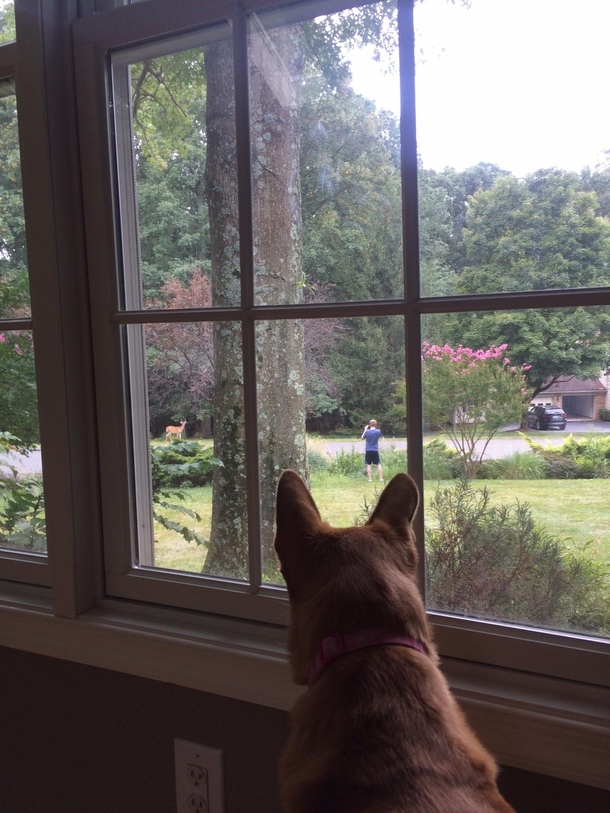
Find the location of a particular element. empty space next to light socket is located at coordinates (107, 735).